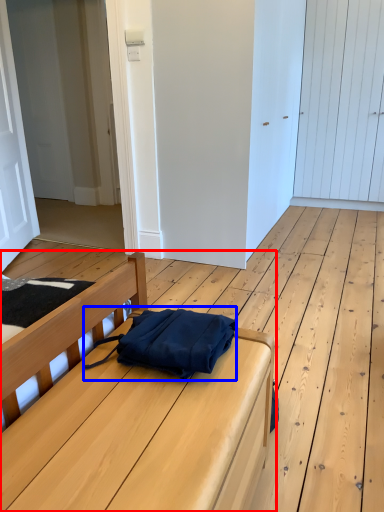
Question: Which of the following is the farthest to the observer, furniture (highlighted by a red box) or messenger bag (highlighted by a blue box)?

Choices:
 (A) furniture
 (B) messenger bag

Answer: (B)